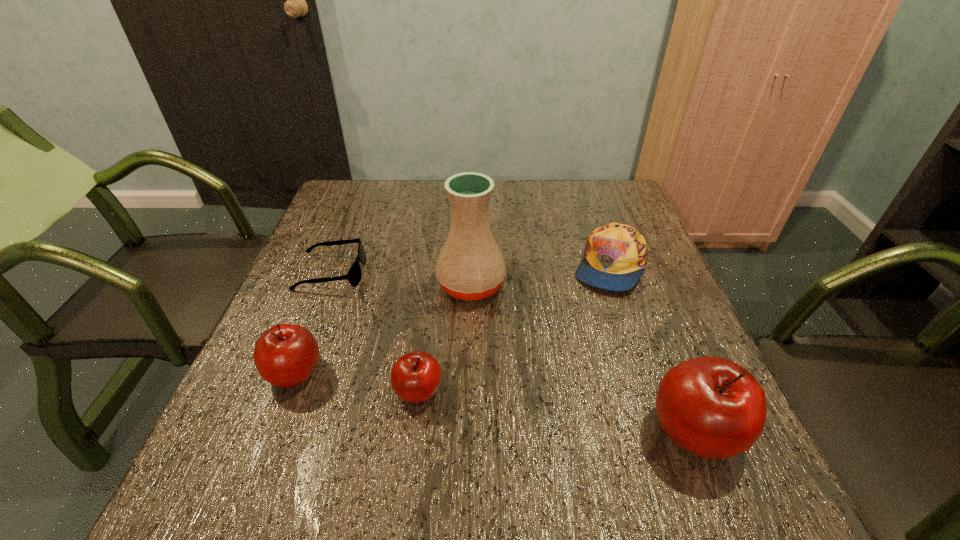
This screenshot has height=540, width=960. What are the coordinates of `vacant region at the near edge of the desktop` in the screenshot? It's located at (337, 423).

Identify the location of free spot at the left edge of the desktop. (359, 238).

The width and height of the screenshot is (960, 540). Identify the location of free space at the right edge of the desktop. (671, 366).

Identify the location of blank space at the far left corner. The height and width of the screenshot is (540, 960). (365, 217).

This screenshot has height=540, width=960. In the image, there is a desktop. Find the location of `vacant space at the near left corner`. vacant space at the near left corner is located at coordinates (263, 410).

Where is `vacant space at the far right corner of the desktop`? vacant space at the far right corner of the desktop is located at coordinates (580, 193).

Find the location of a particular element. The width and height of the screenshot is (960, 540). empty space between the third tallest object and the tallest apple is located at coordinates (495, 402).

Find the location of a particular element. The image size is (960, 540). free spot between the shortest apple and the sunglasses is located at coordinates (374, 332).

Locate an element on the screen. Image resolution: width=960 pixels, height=540 pixels. free space between the second apple from right to left and the rightmost apple is located at coordinates (557, 411).

The image size is (960, 540). What are the coordinates of `free space between the leftmost apple and the shortest apple` in the screenshot? It's located at (356, 382).